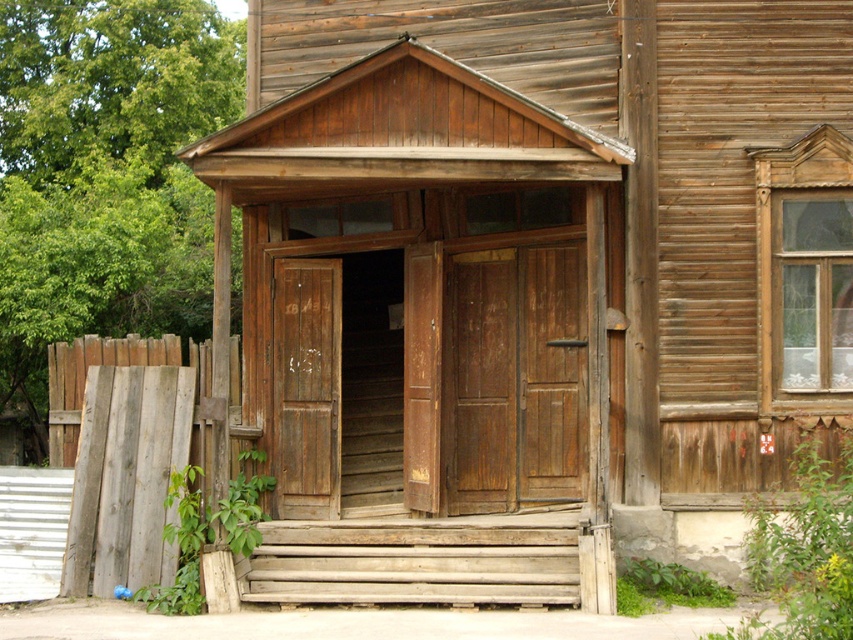
Does weathered wood stairs at center have a lesser width compared to weathered wood fence at lower left?

No, weathered wood stairs at center is not thinner than weathered wood fence at lower left.

Does weathered wood stairs at center lie behind weathered wood fence at lower left?

That is False.

The width and height of the screenshot is (853, 640). What are the coordinates of `weathered wood stairs at center` in the screenshot? It's located at (416, 561).

Is the position of dark brown wooden door at center more distant than that of weathered wood door at center?

No, dark brown wooden door at center is closer to the viewer.

Looking at this image, which is more to the right, dark brown wooden door at center or weathered wood door at center?

dark brown wooden door at center is more to the right.

What do you see at coordinates (514, 378) in the screenshot? I see `dark brown wooden door at center` at bounding box center [514, 378].

The width and height of the screenshot is (853, 640). Find the location of `dark brown wooden door at center`. dark brown wooden door at center is located at coordinates (514, 378).

How much distance is there between weathered wood planks at left and weathered wood fence at lower left?

They are 48.20 centimeters apart.

Who is higher up, weathered wood planks at left or weathered wood fence at lower left?

weathered wood fence at lower left is above.

At what (x,y) coordinates should I click in order to perform the action: click on weathered wood planks at left. Please return your answer as a coordinate pair (x, y). Image resolution: width=853 pixels, height=640 pixels. Looking at the image, I should click on (125, 452).